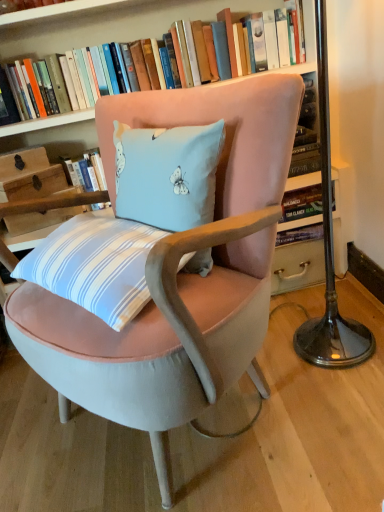
Question: Is velvet pink chair at center taller or shorter than hardcover book at upper center?

Choices:
 (A) tall
 (B) short

Answer: (A)

Question: Which is correct: velvet pink chair at center is inside hardcover book at upper center, or outside of it?

Choices:
 (A) outside
 (B) inside

Answer: (A)

Question: Which object is positioned farthest from the metallic base at right?

Choices:
 (A) hardcover book at upper center
 (B) velvet pink chair at center

Answer: (A)

Question: Which object is positioned closest to the velvet pink chair at center?

Choices:
 (A) metallic base at right
 (B) hardcover book at upper center

Answer: (A)